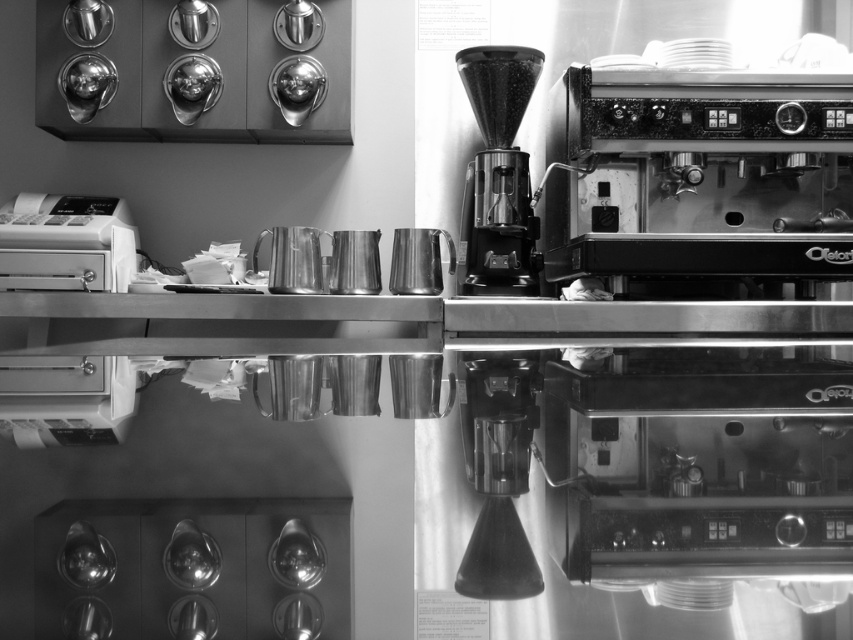
Is metallic stainless steel espresso machine at right bigger than metallic black coffee grinder at center?

Yes.

Is metallic stainless steel espresso machine at right positioned before metallic black coffee grinder at center?

Yes, metallic stainless steel espresso machine at right is closer to the viewer.

The height and width of the screenshot is (640, 853). Identify the location of metallic stainless steel espresso machine at right. (701, 321).

You are a GUI agent. You are given a task and a screenshot of the screen. Output one action in this format:
    pyautogui.click(x=<x>, y=<y>)
    Task: Click on the metallic stainless steel espresso machine at right
    
    Given the screenshot: What is the action you would take?
    pyautogui.click(x=701, y=321)

Is metallic stainless steel espresso machine at right positioned before white plastic cash register at left?

Yes, metallic stainless steel espresso machine at right is in front of white plastic cash register at left.

Does metallic stainless steel espresso machine at right appear over white plastic cash register at left?

Correct, metallic stainless steel espresso machine at right is located above white plastic cash register at left.

The height and width of the screenshot is (640, 853). What are the coordinates of `metallic stainless steel espresso machine at right` in the screenshot? It's located at (701, 321).

Does metallic stainless steel espresso machine at right lie in front of metallic cylindrical filter at center?

No, metallic stainless steel espresso machine at right is behind metallic cylindrical filter at center.

Looking at this image, who is higher up, metallic stainless steel espresso machine at right or metallic cylindrical filter at center?

metallic stainless steel espresso machine at right

Between point (598, 168) and point (479, 589), which one is positioned in front?

Point (479, 589)

What are the coordinates of `metallic stainless steel espresso machine at right` in the screenshot? It's located at (701, 321).